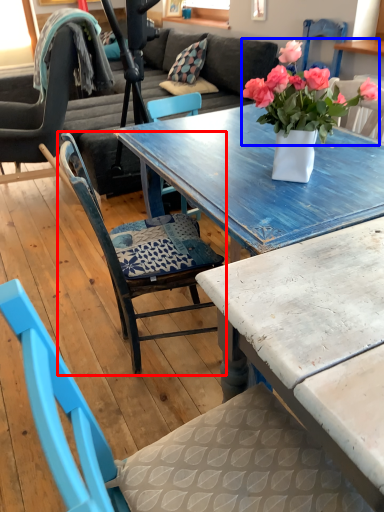
Question: Among these objects, which one is farthest to the camera, chair (highlighted by a red box) or flower (highlighted by a blue box)?

Choices:
 (A) chair
 (B) flower

Answer: (A)